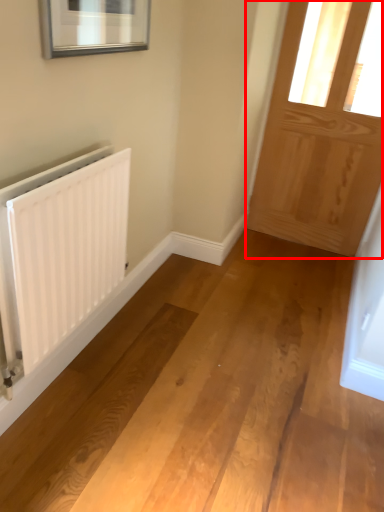
Question: Considering the relative positions of door (annotated by the red box) and radiator in the image provided, where is door (annotated by the red box) located with respect to the staircase?

Choices:
 (A) right
 (B) left

Answer: (A)